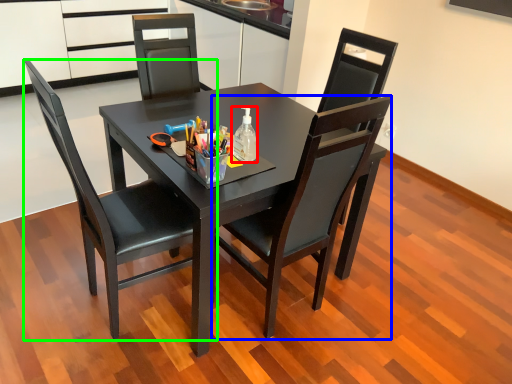
Question: Which object is positioned farthest from bottle (highlighted by a red box)? Select from chair (highlighted by a blue box) and chair (highlighted by a green box).

Choices:
 (A) chair
 (B) chair

Answer: (B)